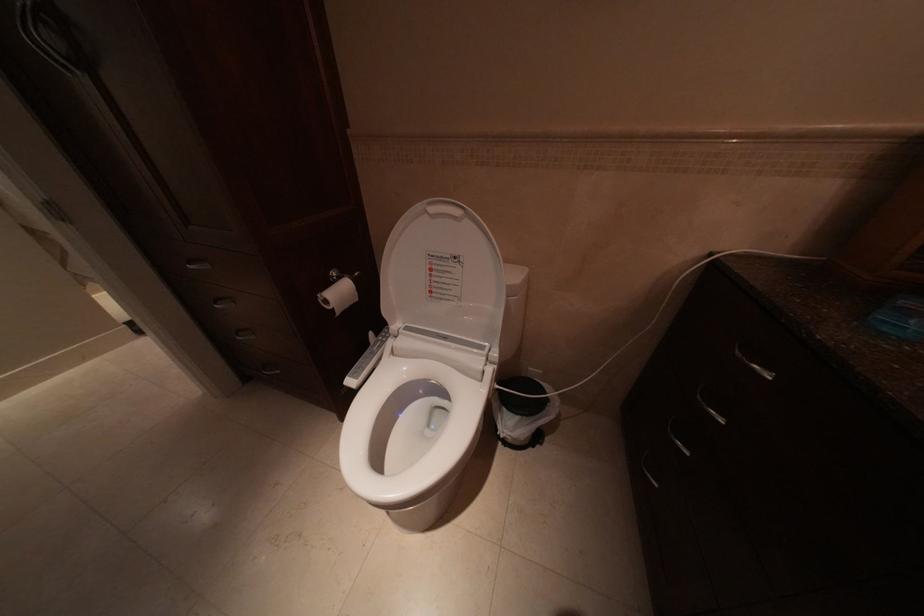
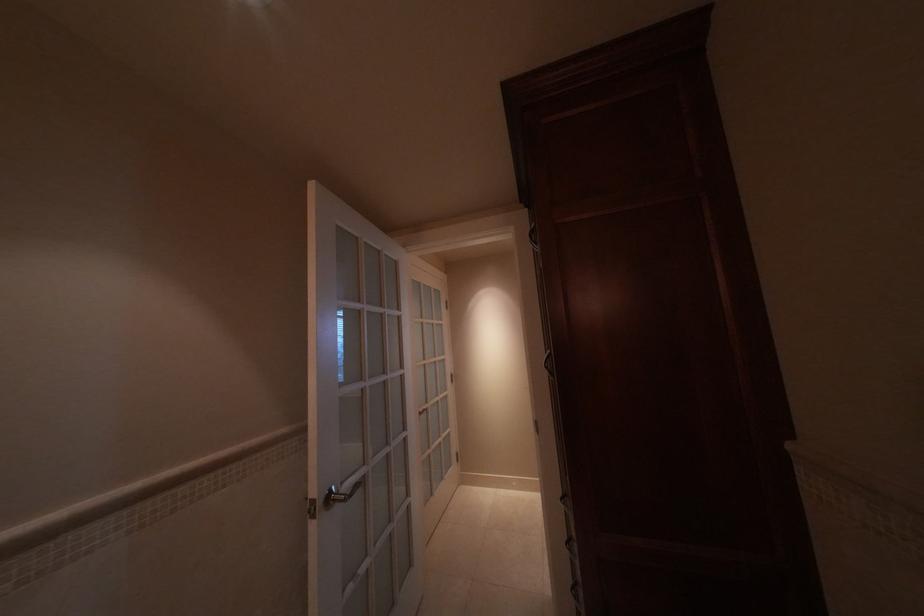
Question: The images are taken continuously from a first-person perspective. In which direction is your viewpoint rotating?

Choices:
 (A) Left
 (B) Right
 (C) Up
 (D) Down

Answer: (A)